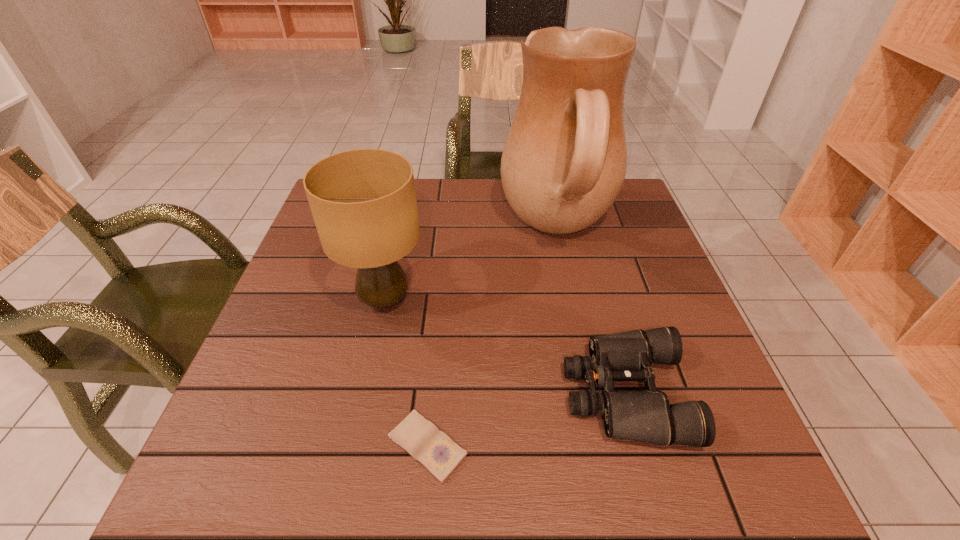
Where is `vacant position at the far edge of the desktop`? This screenshot has width=960, height=540. vacant position at the far edge of the desktop is located at coordinates (475, 183).

You are a GUI agent. You are given a task and a screenshot of the screen. Output one action in this format:
    pyautogui.click(x=<x>, y=<y>)
    Task: Click on the free location at the near edge of the desktop
    The width and height of the screenshot is (960, 540).
    Given the screenshot: What is the action you would take?
    pyautogui.click(x=336, y=487)

You are a GUI agent. You are given a task and a screenshot of the screen. Output one action in this format:
    pyautogui.click(x=<x>, y=<y>)
    Task: Click on the vacant space at the left edge of the desktop
    
    Given the screenshot: What is the action you would take?
    pyautogui.click(x=348, y=277)

This screenshot has height=540, width=960. Identify the location of vacant area at the right edge. (687, 347).

In the image, there is a desktop. Where is `vacant space at the far right corner`? vacant space at the far right corner is located at coordinates (608, 212).

What are the coordinates of `blank region between the lampshade and the shortest object` in the screenshot? It's located at (406, 373).

The height and width of the screenshot is (540, 960). What are the coordinates of `vacant area that lies between the second shortest object and the diary` in the screenshot? It's located at (526, 420).

Identify the location of empty space that is in between the shortest object and the binoculars. (526, 420).

I want to click on free space between the third tallest object and the tallest object, so click(x=591, y=312).

Where is `vacant area that lies between the tallest object and the shortest object`? The image size is (960, 540). vacant area that lies between the tallest object and the shortest object is located at coordinates coord(492,338).